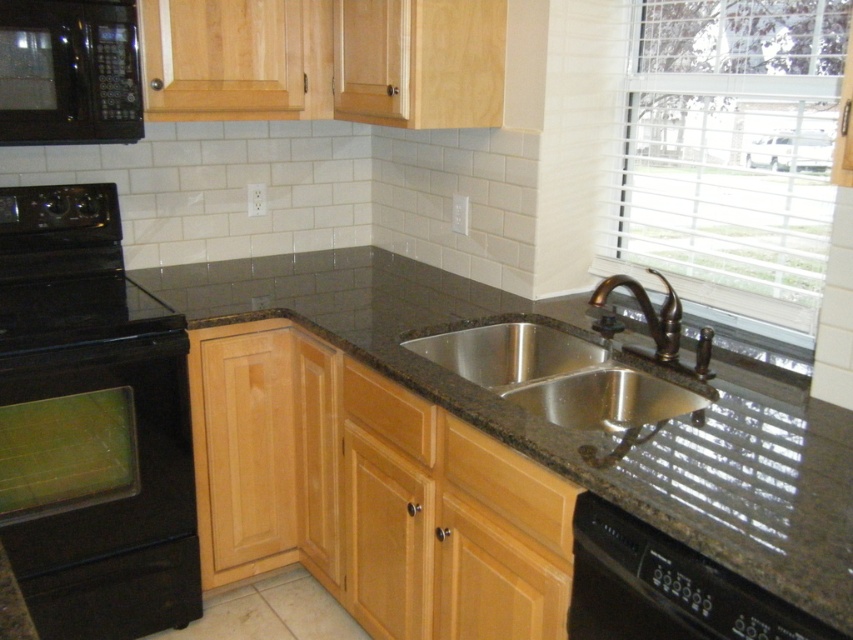
Looking at this image, you are trying to fit a new appliance into this kitchen. The space available is exactly the width of the bronze metallic faucet at sink right. Can the black glossy oven at left fit into this space?

The black glossy oven at left might be wider than bronze metallic faucet at sink right, so it may not fit into the space designated for the faucet.